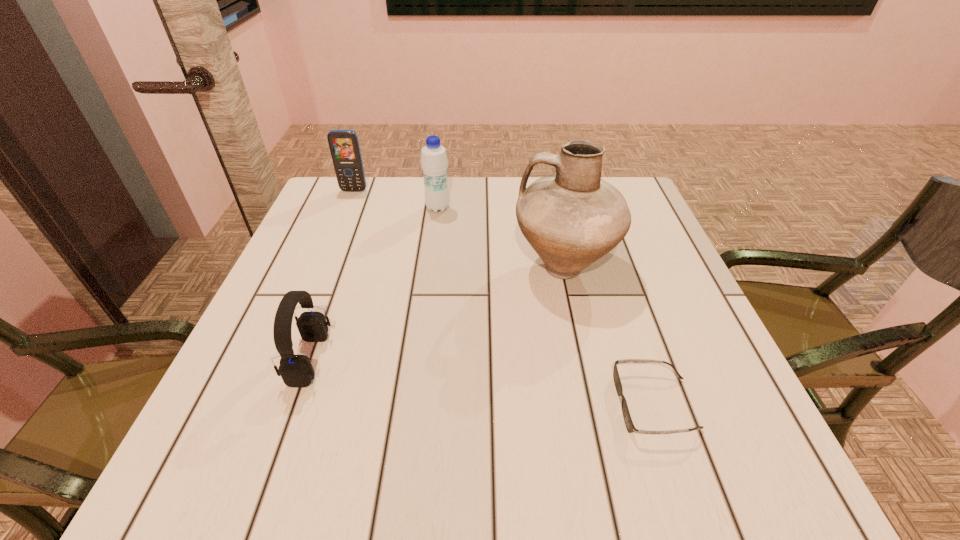
Locate which object ranks in proximity to the farthest object. Please provide its 2D coordinates. Your answer should be formatted as a tuple, i.e. [(x, y)], where the tuple contains the x and y coordinates of a point satisfying the conditions above.

[(434, 160)]

Identify which object is the fourth nearest to the tallest object. Please provide its 2D coordinates. Your answer should be formatted as a tuple, i.e. [(x, y)], where the tuple contains the x and y coordinates of a point satisfying the conditions above.

[(344, 146)]